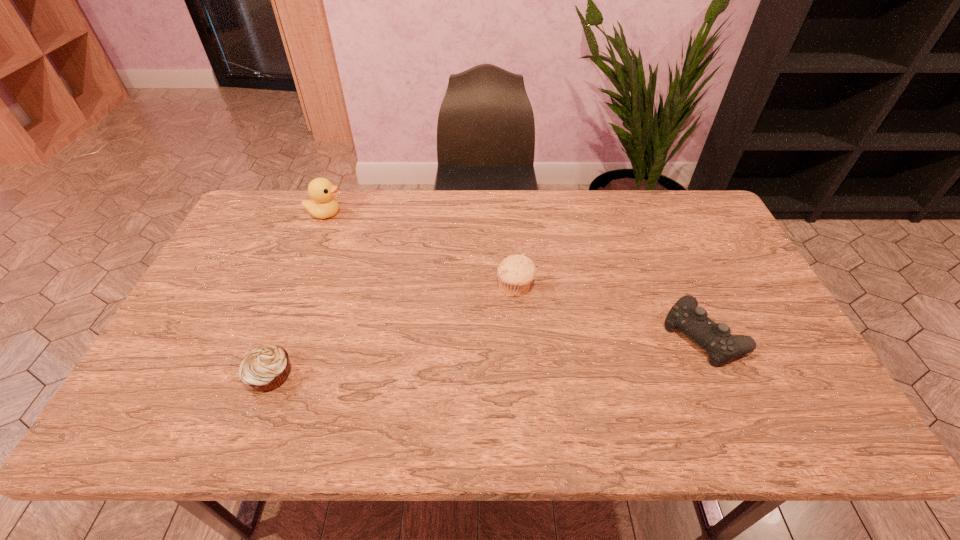
At what (x,y) coordinates should I click in order to perform the action: click on free space that satisfies the following two spatial constraints: 1. on the face of the third nearest object; 2. on the right side of the duck. Please return your answer as a coordinate pair (x, y). This screenshot has width=960, height=540. Looking at the image, I should click on (x=296, y=288).

The width and height of the screenshot is (960, 540). In order to click on free location that satisfies the following two spatial constraints: 1. on the back side of the nearer muffin; 2. on the face of the tallest object in this screenshot , I will do `click(332, 213)`.

Image resolution: width=960 pixels, height=540 pixels. I want to click on free location that satisfies the following two spatial constraints: 1. on the front side of the right muffin; 2. on the right side of the control, so click(518, 334).

Identify the location of free space in the image that satisfies the following two spatial constraints: 1. on the back side of the shorter muffin; 2. on the face of the farthest object. The width and height of the screenshot is (960, 540). (332, 213).

The image size is (960, 540). I want to click on free space that satisfies the following two spatial constraints: 1. on the face of the second farthest object; 2. on the left side of the duck, so click(x=296, y=288).

Where is `vacant space that satisfies the following two spatial constraints: 1. on the face of the shorter muffin; 2. on the left side of the duck`? vacant space that satisfies the following two spatial constraints: 1. on the face of the shorter muffin; 2. on the left side of the duck is located at coordinates 261,376.

Where is `free space that satisfies the following two spatial constraints: 1. on the face of the farthest object; 2. on the left side of the control`? The image size is (960, 540). free space that satisfies the following two spatial constraints: 1. on the face of the farthest object; 2. on the left side of the control is located at coordinates (277, 334).

You are a GUI agent. You are given a task and a screenshot of the screen. Output one action in this format:
    pyautogui.click(x=<x>, y=<y>)
    Task: Click on the free space that satisfies the following two spatial constraints: 1. on the face of the rightmost object; 2. on the right side of the farthest object
    
    Given the screenshot: What is the action you would take?
    pyautogui.click(x=277, y=334)